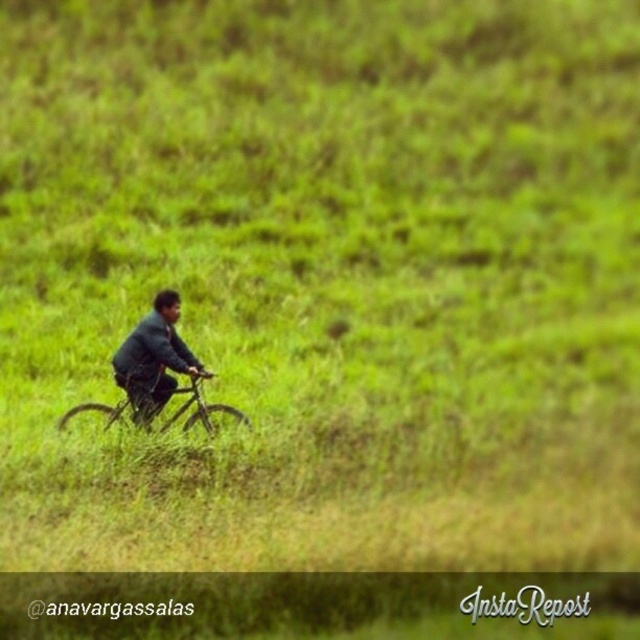
You are a photographer trying to capture the rider and the bicycle in the image. Since the dark blue fabric jacket at center and the metallic silver mountain bike at center are both at the center, which one should you focus on to ensure the jacket is in focus while the bike is slightly blurred?

To focus on the dark blue fabric jacket at center and have the metallic silver mountain bike at center slightly blurred, you should adjust the camera to focus on the jacket, which is above the bike. This way, the jacket will be sharp while the bike, being lower, may appear less in focus depending on the depth of field.

You are a photographer trying to capture the dark blue fabric jacket at center while the person is riding the bicycle through the green field. Based on the jacket

The dark blue fabric jacket at center is located at point

You are a photographer standing at the camera position. You want to take a closeup shot of the dark blue fabric jacket at center. Considering the jacket is 14.10 meters away, can you capture it clearly with a standard zoom lens that has a maximum zoom of 100mm?

The dark blue fabric jacket at center is 14.10 meters from the camera. A standard zoom lens with a maximum of 100mm may not provide sufficient magnification to capture the jacket clearly at that distance. A telephoto lens with a longer focal length would be more appropriate for such a distant subject.